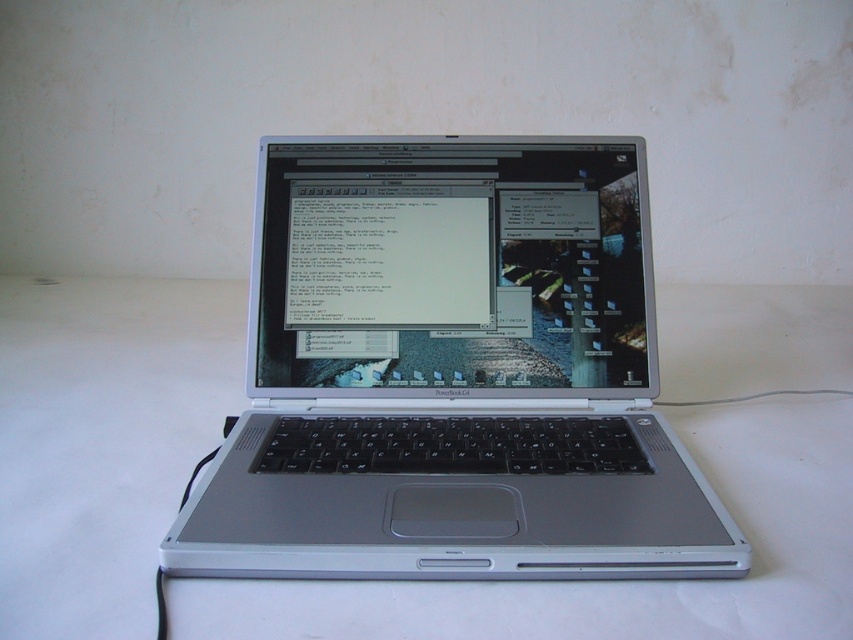
Question: Among these points, which one is farthest from the camera?

Choices:
 (A) (798, 353)
 (B) (582, 477)

Answer: (A)

Question: Is silver metallic laptop at center further to the viewer compared to white matte table at center?

Choices:
 (A) no
 (B) yes

Answer: (B)

Question: In this image, where is silver metallic laptop at center located relative to white matte table at center?

Choices:
 (A) above
 (B) below

Answer: (A)

Question: In this image, where is silver metallic laptop at center located relative to white matte table at center?

Choices:
 (A) left
 (B) right

Answer: (A)

Question: Which of the following is the closest to the observer?

Choices:
 (A) silver metallic laptop at center
 (B) white matte table at center

Answer: (B)